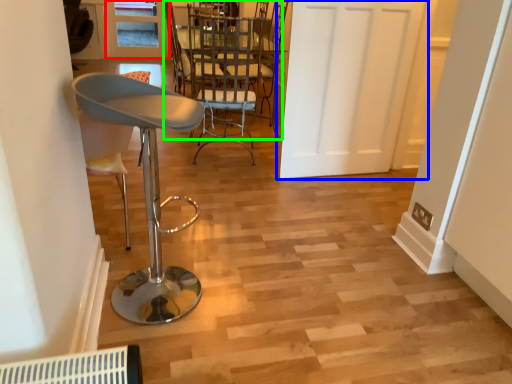
Question: Which object is the closest to the window (highlighted by a red box)? Choose among these: door (highlighted by a blue box) or chair (highlighted by a green box).

Choices:
 (A) door
 (B) chair

Answer: (B)